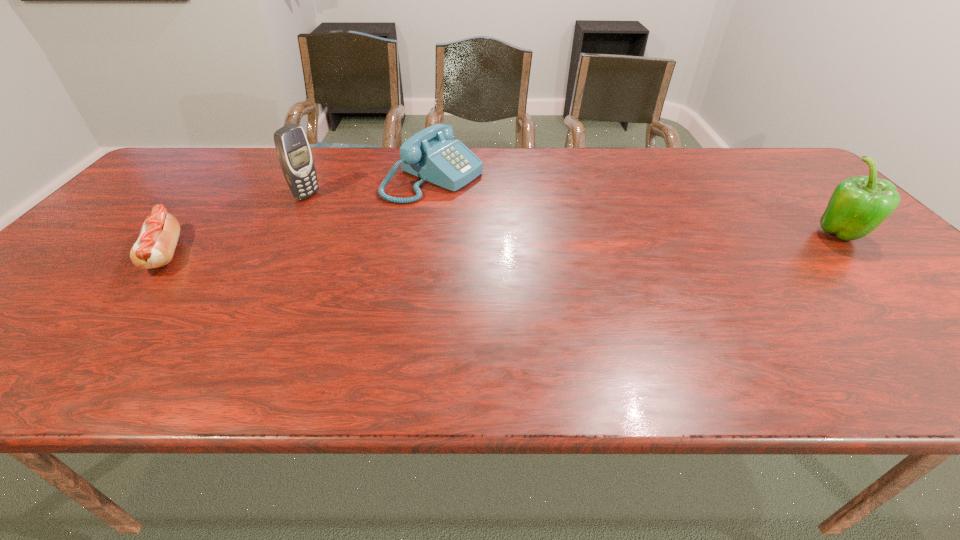
The width and height of the screenshot is (960, 540). I want to click on vacant area located on the dial of the third object from left to right, so click(x=559, y=226).

At what (x,y) coordinates should I click in order to perform the action: click on vacant space situated on the front face of the cellular telephone. Please return your answer as a coordinate pair (x, y). Image resolution: width=960 pixels, height=540 pixels. Looking at the image, I should click on (339, 209).

This screenshot has height=540, width=960. In order to click on blank space located 0.180m on the front face of the cellular telephone in this screenshot , I will do `click(364, 218)`.

Where is `vacant point located 0.190m on the front face of the cellular telephone`? vacant point located 0.190m on the front face of the cellular telephone is located at coordinates (367, 219).

At what (x,y) coordinates should I click in order to perform the action: click on object that is at the far edge. Please return your answer as a coordinate pair (x, y). Image resolution: width=960 pixels, height=540 pixels. Looking at the image, I should click on (431, 154).

Identify the location of object present at the right edge. The image size is (960, 540). (858, 205).

In the image, there is a desktop. Where is `vacant space at the far edge`? vacant space at the far edge is located at coordinates (220, 170).

Find the location of a particular element. This screenshot has width=960, height=540. vacant space at the near edge of the desktop is located at coordinates (642, 341).

The width and height of the screenshot is (960, 540). I want to click on free space at the left edge of the desktop, so coord(127,242).

You are a GUI agent. You are given a task and a screenshot of the screen. Output one action in this format:
    pyautogui.click(x=<x>, y=<y>)
    Task: Click on the blank space at the right edge
    The height and width of the screenshot is (540, 960).
    Given the screenshot: What is the action you would take?
    pyautogui.click(x=879, y=255)